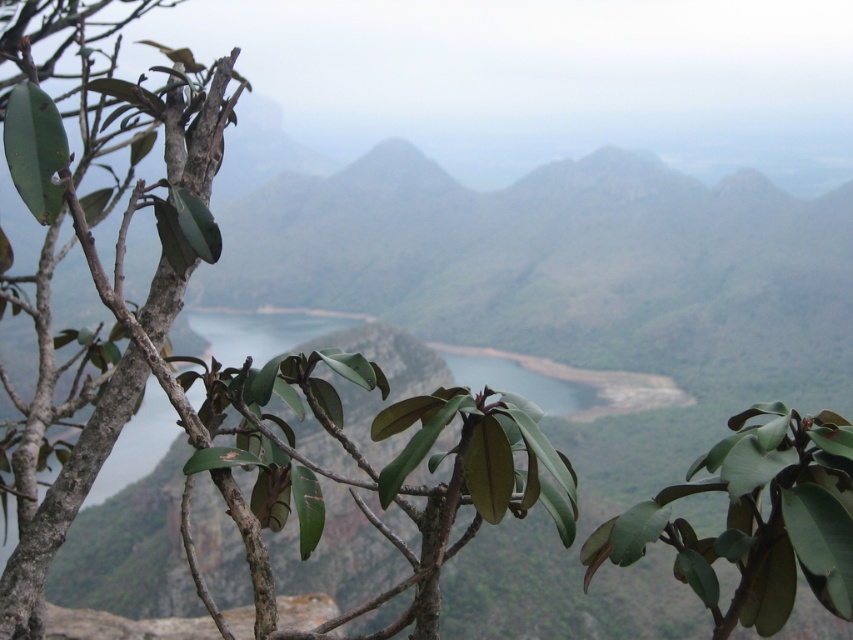
You are standing at the point marked by the coordinates point [213,358] in the image. Looking around, what do you see immediately around you?

The point [213,358] marks green matte leaves at center, so you are surrounded by green matte leaves at center.